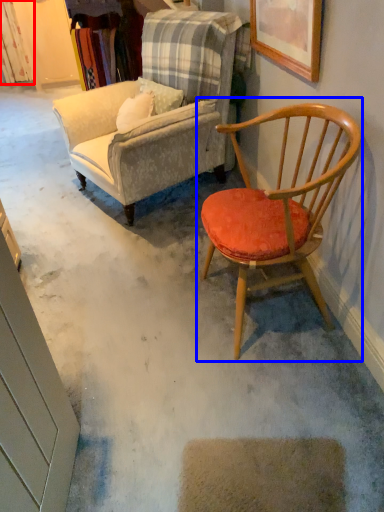
Question: Which of the following is the farthest to the observer, curtain (highlighted by a red box) or chair (highlighted by a blue box)?

Choices:
 (A) curtain
 (B) chair

Answer: (A)